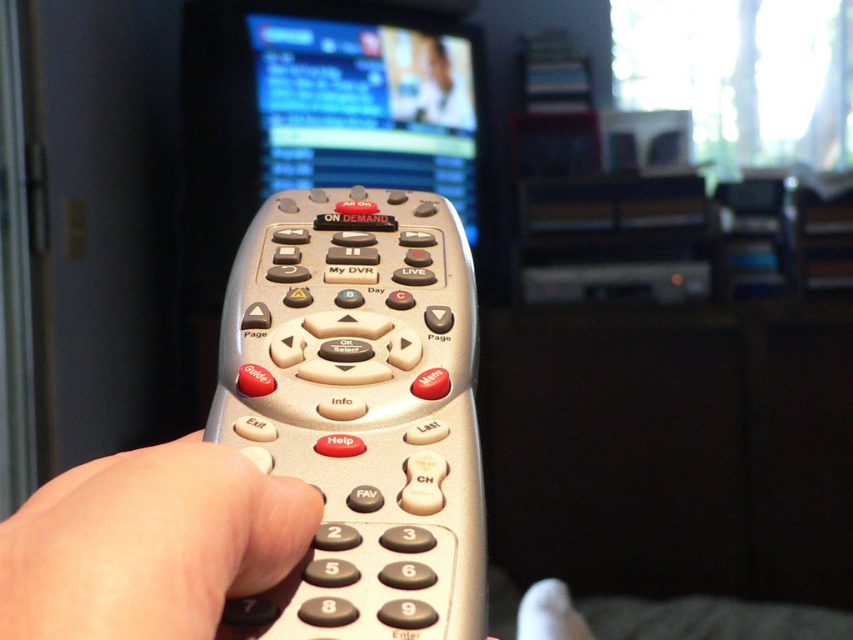
What do you see at coordinates (360, 410) in the screenshot? The height and width of the screenshot is (640, 853). I see `silver metallic remote at center` at bounding box center [360, 410].

Between silver metallic remote at center and skinny beige hand at center, which one is positioned lower?

skinny beige hand at center is lower down.

Between point (337, 483) and point (155, 449), which one is positioned in front?

Point (155, 449) is in front.

Identify the location of silver metallic remote at center. (360, 410).